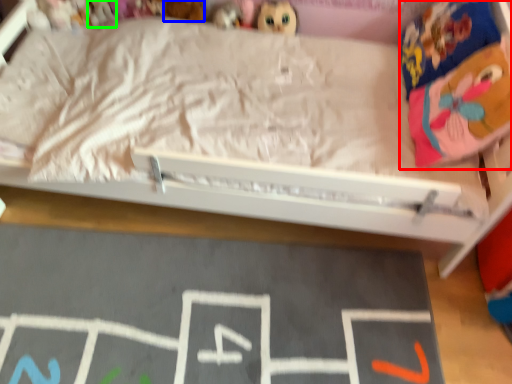
Question: Estimate the real-world distances between objects in this image. Which object is farther from stuff (highlighted by a red box), toy (highlighted by a blue box) or toy (highlighted by a green box)?

Choices:
 (A) toy
 (B) toy

Answer: (B)